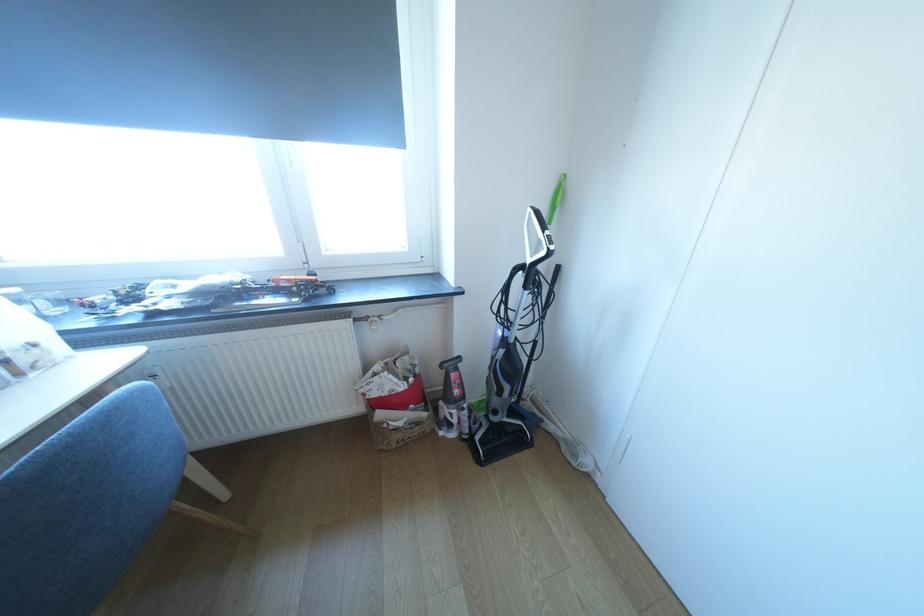
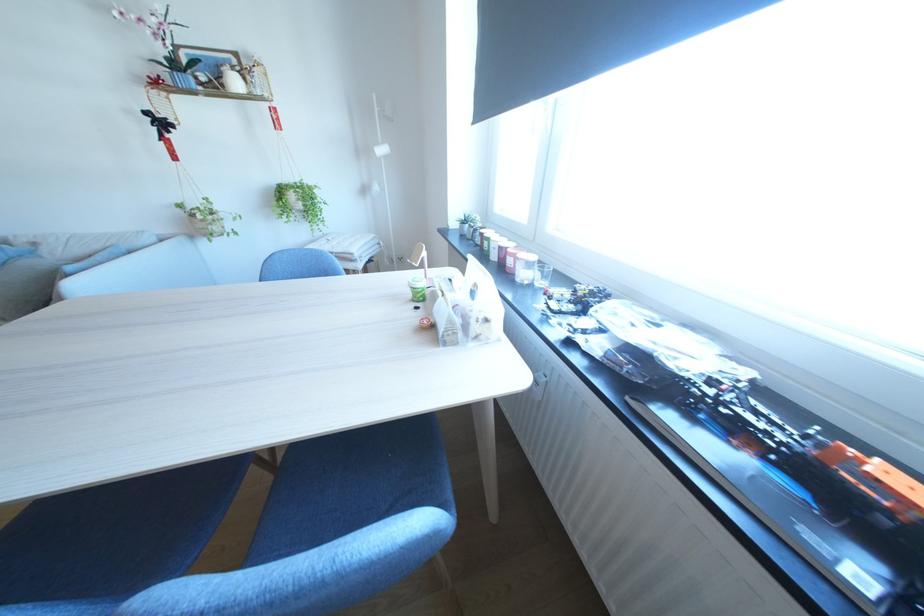
Find the pixel in the second image that matches the point at 56,315 in the first image.

(545, 285)